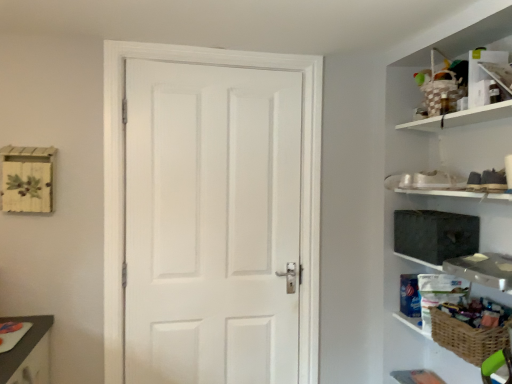
The height and width of the screenshot is (384, 512). What are the coordinates of `woven wicker basket at right` in the screenshot? It's located at (440, 356).

The image size is (512, 384). Describe the element at coordinates (440, 356) in the screenshot. I see `woven wicker basket at right` at that location.

This screenshot has width=512, height=384. What do you see at coordinates (435, 235) in the screenshot?
I see `dark gray fabric medicine cabinet at right` at bounding box center [435, 235].

Where is `woven wicker basket at right`? This screenshot has width=512, height=384. woven wicker basket at right is located at coordinates (440, 356).

Considering the positions of objects woven brown basket at lower right and woven wicker basket at right in the image provided, who is more to the left, woven brown basket at lower right or woven wicker basket at right?

woven brown basket at lower right.

Is woven brown basket at lower right spatially inside woven wicker basket at right, or outside of it?

woven brown basket at lower right is spatially situated outside woven wicker basket at right.

Does woven brown basket at lower right lie in front of woven wicker basket at right?

Yes, woven brown basket at lower right is in front of woven wicker basket at right.

From a real-world perspective, which object stands above the other?

woven brown basket at lower right, from a real-world perspective.

Looking at this image, from a real-world perspective, is woven wicker basket at right physically located above or below woven brown basket at lower right?

woven wicker basket at right is situated lower than woven brown basket at lower right in the real world.

Is woven wicker basket at right placed right next to woven brown basket at lower right?

There is a gap between woven wicker basket at right and woven brown basket at lower right.

Considering the sizes of objects woven wicker basket at right and woven brown basket at lower right in the image provided, who is thinner, woven wicker basket at right or woven brown basket at lower right?

woven wicker basket at right.

Is woven wicker basket at right positioned in front of woven brown basket at lower right?

No, woven wicker basket at right is further to the viewer.

Which is less distant, (167, 280) or (450, 222)?

Point (450, 222)

Are white matte door at center and dark gray fabric medicine cabinet at right beside each other?

They are not placed beside each other.

Is white matte door at center spatially inside dark gray fabric medicine cabinet at right, or outside of it?

white matte door at center is not enclosed by dark gray fabric medicine cabinet at right.

Is white matte door at center oriented towards dark gray fabric medicine cabinet at right?

No, white matte door at center is not turned towards dark gray fabric medicine cabinet at right.

Measure the distance from woven wicker basket at right to dark gray fabric medicine cabinet at right.

The distance of woven wicker basket at right from dark gray fabric medicine cabinet at right is 17.43 inches.

Which object is positioned more to the right, woven wicker basket at right or dark gray fabric medicine cabinet at right?

From the viewer's perspective, woven wicker basket at right appears more on the right side.

Could you tell me if woven wicker basket at right is facing dark gray fabric medicine cabinet at right?

No, woven wicker basket at right is not aimed at dark gray fabric medicine cabinet at right.

Is woven wicker basket at right positioned far away from dark gray fabric medicine cabinet at right?

No, woven wicker basket at right is not far away from dark gray fabric medicine cabinet at right.

What's the angular difference between dark gray fabric medicine cabinet at right and white matte door at center's facing directions?

The facing directions of dark gray fabric medicine cabinet at right and white matte door at center are 88.6 degrees apart.

From a real-world perspective, is dark gray fabric medicine cabinet at right physically located above or below white matte door at center?

dark gray fabric medicine cabinet at right is above white matte door at center.

Consider the image. Is white matte door at center at the back of dark gray fabric medicine cabinet at right?

No, white matte door at center is not at the back of dark gray fabric medicine cabinet at right.

Based on the photo, is dark gray fabric medicine cabinet at right surrounding white matte door at center?

No.

From a real-world perspective, is woven brown basket at lower right over dark gray fabric medicine cabinet at right?

Actually, woven brown basket at lower right is physically below dark gray fabric medicine cabinet at right in the real world.

Which object is positioned more to the left, woven brown basket at lower right or dark gray fabric medicine cabinet at right?

Positioned to the left is dark gray fabric medicine cabinet at right.

Which object is closer to the camera, woven brown basket at lower right or dark gray fabric medicine cabinet at right?

woven brown basket at lower right is closer to the camera.

Based on the photo, which is more to the right, dark gray fabric medicine cabinet at right or woven brown basket at lower right?

woven brown basket at lower right is more to the right.

Does dark gray fabric medicine cabinet at right have a smaller size compared to woven brown basket at lower right?

No, dark gray fabric medicine cabinet at right is not smaller than woven brown basket at lower right.

In the scene shown: From a real-world perspective, is dark gray fabric medicine cabinet at right over woven brown basket at lower right?

Indeed, from a real-world perspective, dark gray fabric medicine cabinet at right stands above woven brown basket at lower right.

The image size is (512, 384). I want to click on cabinet behind the woven brown basket at lower right, so click(x=440, y=356).

Locate an element on the screen. This screenshot has height=384, width=512. basket on the left of woven wicker basket at right is located at coordinates [x=467, y=337].

From the image, which object appears to be farther from woven brown basket at lower right, white matte door at center or dark gray fabric medicine cabinet at right?

white matte door at center lies further to woven brown basket at lower right than the other object.

When comparing their distances from dark gray fabric medicine cabinet at right, does woven brown basket at lower right or woven wicker basket at right seem closer?

Based on the image, woven brown basket at lower right appears to be nearer to dark gray fabric medicine cabinet at right.

From the image, which object appears to be nearer to dark gray fabric medicine cabinet at right, woven brown basket at lower right or white matte door at center?

The object closer to dark gray fabric medicine cabinet at right is woven brown basket at lower right.

Estimate the real-world distances between objects in this image. Which object is closer to woven wicker basket at right, dark gray fabric medicine cabinet at right or white matte door at center?

dark gray fabric medicine cabinet at right lies closer to woven wicker basket at right than the other object.

Based on their spatial positions, is white matte door at center or woven brown basket at lower right closer to dark gray fabric medicine cabinet at right?

woven brown basket at lower right is closer to dark gray fabric medicine cabinet at right.

Which object lies further to the anchor point woven brown basket at lower right, white matte door at center or woven wicker basket at right?

Based on the image, white matte door at center appears to be further to woven brown basket at lower right.

Which object lies nearer to the anchor point white matte door at center, woven wicker basket at right or dark gray fabric medicine cabinet at right?

Among the two, dark gray fabric medicine cabinet at right is located nearer to white matte door at center.

From the image, which object appears to be farther from white matte door at center, woven wicker basket at right or woven brown basket at lower right?

woven brown basket at lower right is positioned further to the anchor white matte door at center.

Find the location of a particular element. basket situated between white matte door at center and woven wicker basket at right from left to right is located at coordinates (467, 337).

At what (x,y) coordinates should I click in order to perform the action: click on medicine cabinet located between white matte door at center and woven wicker basket at right in the left-right direction. Please return your answer as a coordinate pair (x, y). Looking at the image, I should click on (435, 235).

Locate an element on the screen. Image resolution: width=512 pixels, height=384 pixels. basket between dark gray fabric medicine cabinet at right and woven wicker basket at right in the vertical direction is located at coordinates (467, 337).

The height and width of the screenshot is (384, 512). What are the coordinates of `medicine cabinet located between white matte door at center and woven brown basket at lower right in the left-right direction` in the screenshot? It's located at (435, 235).